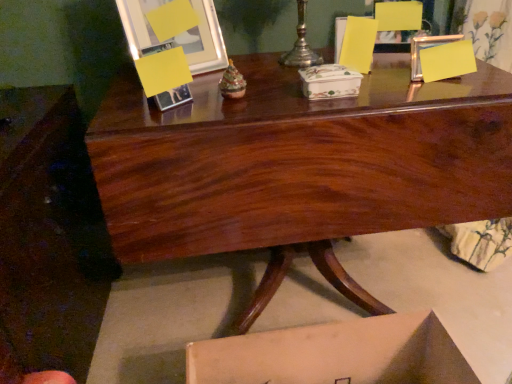
You are a GUI agent. You are given a task and a screenshot of the screen. Output one action in this format:
    pyautogui.click(x=<x>, y=<y>)
    Task: Click on the vacant area that is situated to the right of porcelain floral box at center
    The width and height of the screenshot is (512, 384).
    Given the screenshot: What is the action you would take?
    pyautogui.click(x=396, y=92)